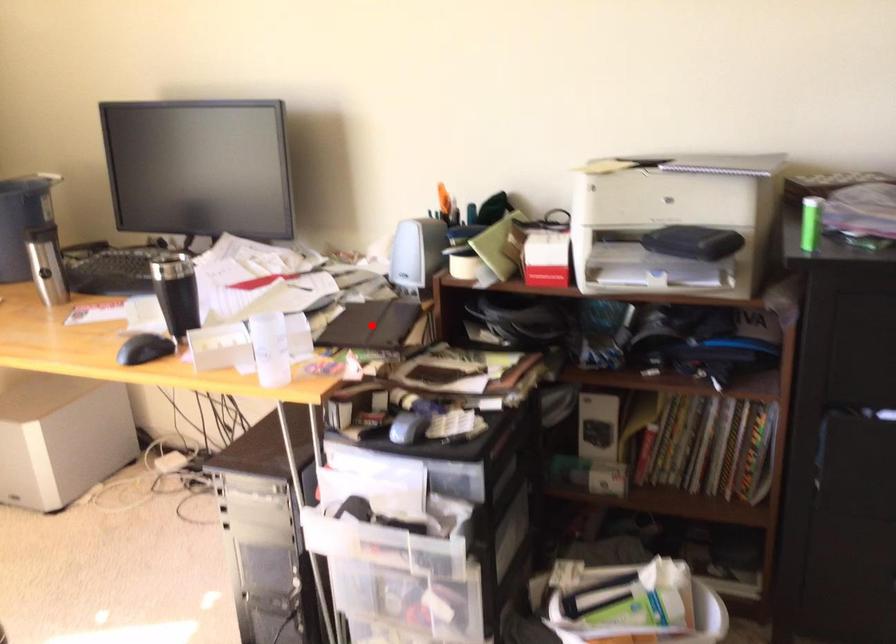
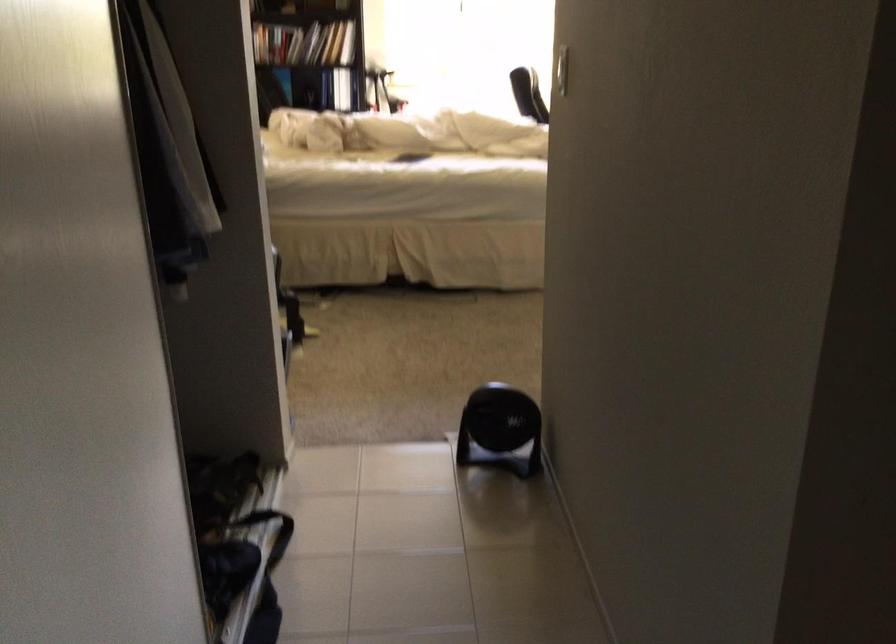
Question: I am providing you with two images of the same scene from different viewpoints. A red point is marked on the first image. At the location where the point appears in image 1, is it still visible in image 2?

Choices:
 (A) Yes
 (B) No

Answer: (B)